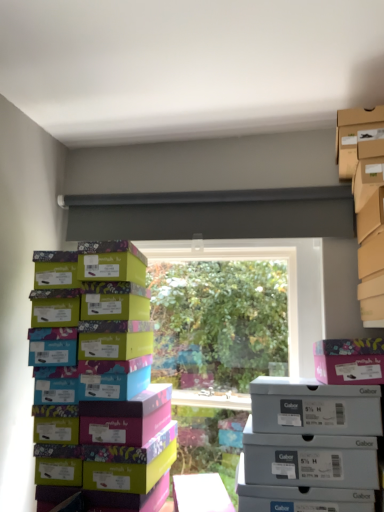
Question: Is gray matte shoebox at lower right, the second storage box positioned from the top, smaller than pink cardboard box at upper right?

Choices:
 (A) no
 (B) yes

Answer: (A)

Question: From a real-world perspective, is gray matte shoebox at lower right, positioned as the 1th storage box in bottom-to-top order, under pink cardboard box at upper right?

Choices:
 (A) yes
 (B) no

Answer: (A)

Question: Is gray matte shoebox at lower right, positioned as the 1th storage box in bottom-to-top order, looking in the opposite direction of pink cardboard box at upper right?

Choices:
 (A) no
 (B) yes

Answer: (A)

Question: Does gray matte shoebox at lower right, the second storage box positioned from the top, have a lesser width compared to pink cardboard box at upper right?

Choices:
 (A) yes
 (B) no

Answer: (A)

Question: From a real-world perspective, is gray matte shoebox at lower right, positioned as the 1th storage box in bottom-to-top order, over pink cardboard box at upper right?

Choices:
 (A) no
 (B) yes

Answer: (A)

Question: Is gray matte shoebox at lower right, positioned as the 1th storage box in bottom-to-top order, bigger or smaller than cardboard shoebox at upper right, the second storage box ordered from the bottom?

Choices:
 (A) small
 (B) big

Answer: (B)

Question: From the image's perspective, is gray matte shoebox at lower right, the second storage box positioned from the top, above or below cardboard shoebox at upper right, the second storage box ordered from the bottom?

Choices:
 (A) above
 (B) below

Answer: (B)

Question: From a real-world perspective, relative to cardboard shoebox at upper right, placed as the 1th storage box when sorted from top to bottom, is gray matte shoebox at lower right, the second storage box positioned from the top, vertically above or below?

Choices:
 (A) above
 (B) below

Answer: (B)

Question: From their relative heights in the image, would you say gray matte shoebox at lower right, the second storage box positioned from the top, is taller or shorter than cardboard shoebox at upper right, placed as the 1th storage box when sorted from top to bottom?

Choices:
 (A) short
 (B) tall

Answer: (B)

Question: Is pink cardboard box at upper right taller or shorter than multicolored cardboard shoebox at left?

Choices:
 (A) tall
 (B) short

Answer: (B)

Question: Relative to multicolored cardboard shoebox at left, is pink cardboard box at upper right in front or behind?

Choices:
 (A) behind
 (B) front

Answer: (A)

Question: Is pink cardboard box at upper right bigger or smaller than multicolored cardboard shoebox at left?

Choices:
 (A) small
 (B) big

Answer: (A)

Question: Would you say pink cardboard box at upper right is inside or outside multicolored cardboard shoebox at left?

Choices:
 (A) outside
 (B) inside

Answer: (A)

Question: In the image, is gray matte shoebox at lower right, the second storage box positioned from the top, on the left side or the right side of pink cardboard box at upper right?

Choices:
 (A) right
 (B) left

Answer: (B)

Question: Is point (284, 475) positioned closer to the camera than point (316, 357)?

Choices:
 (A) farther
 (B) closer

Answer: (B)